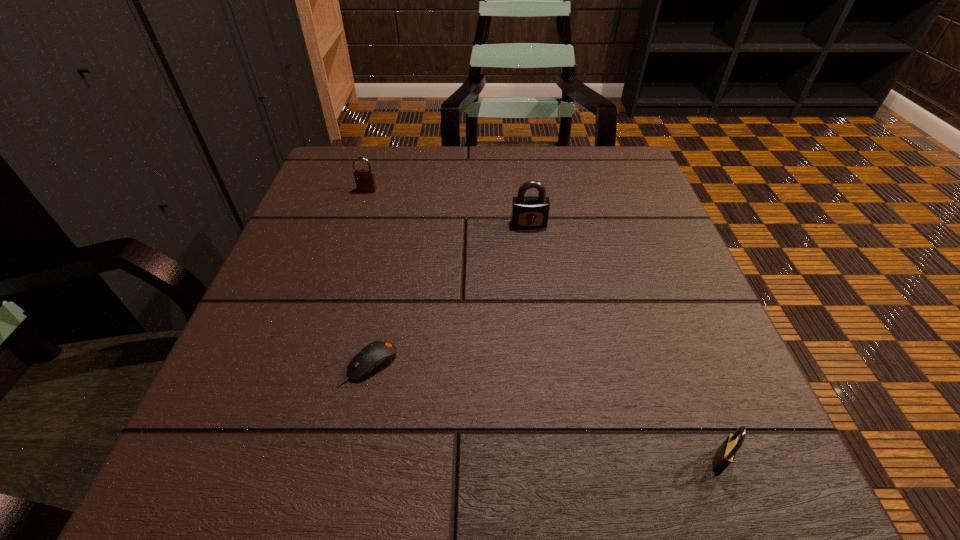
Find the location of `the second farthest object`. the second farthest object is located at coordinates (528, 212).

You are a GUI agent. You are given a task and a screenshot of the screen. Output one action in this format:
    pyautogui.click(x=<x>, y=<y>)
    Task: Click on the tallest object
    The image size is (960, 540).
    Given the screenshot: What is the action you would take?
    pyautogui.click(x=528, y=212)

Identify the location of the farthest object. The image size is (960, 540). (365, 180).

Identify the location of the leftmost padlock. Image resolution: width=960 pixels, height=540 pixels. (365, 180).

You are a GUI agent. You are given a task and a screenshot of the screen. Output one action in this format:
    pyautogui.click(x=<x>, y=<y>)
    Task: Click on the rightmost padlock
    
    Given the screenshot: What is the action you would take?
    pyautogui.click(x=725, y=454)

Find the location of a particular element. The image size is (960, 540). the rightmost object is located at coordinates (725, 454).

You are a GUI agent. You are given a task and a screenshot of the screen. Output one action in this format:
    pyautogui.click(x=<x>, y=<y>)
    Task: Click on the shortest object
    The height and width of the screenshot is (540, 960).
    Given the screenshot: What is the action you would take?
    pyautogui.click(x=375, y=356)

Locate an element on the screen. Image resolution: width=960 pixels, height=540 pixels. computer mouse is located at coordinates (375, 356).

Identify the location of blank space located on the front of the second farthest object near the keyhole. (540, 318).

Identify the location of free location located 0.250m on the front-facing side of the farthest object. The image size is (960, 540). (343, 266).